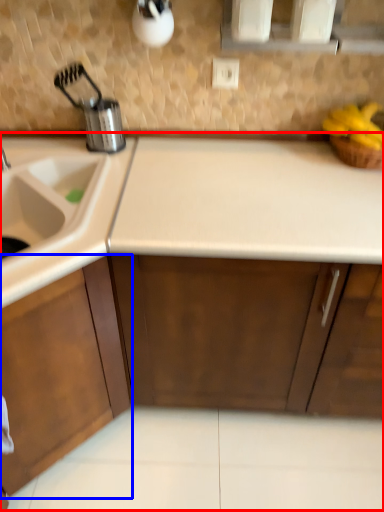
Question: Among these objects, which one is nearest to the camera, countertop (highlighted by a red box) or cabinetry (highlighted by a blue box)?

Choices:
 (A) countertop
 (B) cabinetry

Answer: (B)